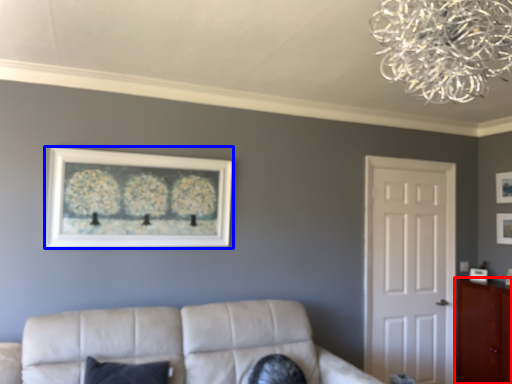
Question: Which of the following is the farthest to the observer, cabinetry (highlighted by a red box) or picture frame (highlighted by a blue box)?

Choices:
 (A) cabinetry
 (B) picture frame

Answer: (A)